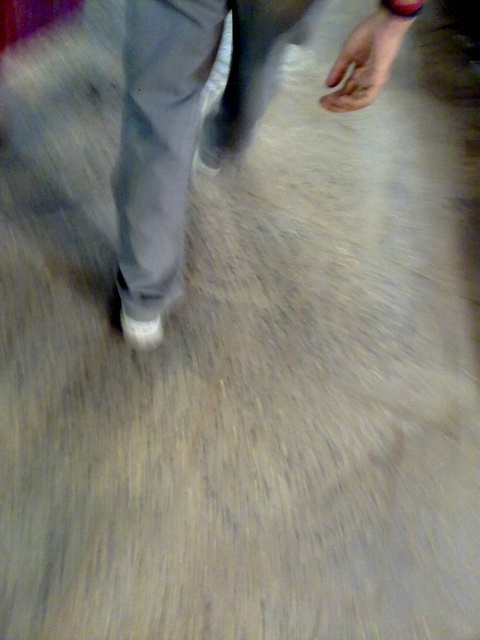
This screenshot has width=480, height=640. What do you see at coordinates (183, 124) in the screenshot?
I see `white fabric pants at center` at bounding box center [183, 124].

Is point (393, 42) in front of point (123, 332)?

Yes.

Identify the location of white fabric pants at center. (183, 124).